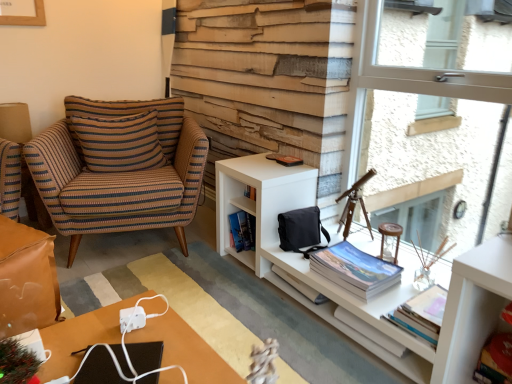
Question: Can you confirm if white paper book at center, which appears as the 2th book when viewed from the right, is taller than matte paper book at lower right, the 3th book in the right-to-left sequence?

Choices:
 (A) yes
 (B) no

Answer: (B)

Question: Does white paper book at center, which appears as the 2th book when viewed from the right, turn towards matte paper book at lower right, the second book when ordered from left to right?

Choices:
 (A) yes
 (B) no

Answer: (B)

Question: From the image's perspective, is white paper book at center, which appears as the 2th book when viewed from the right, beneath matte paper book at lower right, the 3th book in the right-to-left sequence?

Choices:
 (A) yes
 (B) no

Answer: (A)

Question: From the image's perspective, is white paper book at center, the 3th book positioned from the left, above matte paper book at lower right, the second book when ordered from left to right?

Choices:
 (A) no
 (B) yes

Answer: (A)

Question: From a real-world perspective, is white paper book at center, which appears as the 2th book when viewed from the right, located higher than matte paper book at lower right, the second book when ordered from left to right?

Choices:
 (A) no
 (B) yes

Answer: (A)

Question: Considering the positions of striped fabric pillow at upper left and brown leather table at lower left in the image, is striped fabric pillow at upper left bigger or smaller than brown leather table at lower left?

Choices:
 (A) big
 (B) small

Answer: (B)

Question: From their relative heights in the image, would you say striped fabric pillow at upper left is taller or shorter than brown leather table at lower left?

Choices:
 (A) tall
 (B) short

Answer: (B)

Question: From a real-world perspective, is striped fabric pillow at upper left physically located above or below brown leather table at lower left?

Choices:
 (A) below
 (B) above

Answer: (B)

Question: Considering the positions of point (83, 127) and point (30, 306), is point (83, 127) closer or farther from the camera than point (30, 306)?

Choices:
 (A) farther
 (B) closer

Answer: (A)

Question: Is point (362, 125) positioned closer to the camera than point (19, 238)?

Choices:
 (A) farther
 (B) closer

Answer: (A)

Question: Based on their positions, is transparent glass window at upper right located to the left or right of brown leather table at lower left?

Choices:
 (A) left
 (B) right

Answer: (B)

Question: Is transparent glass window at upper right inside or outside of brown leather table at lower left?

Choices:
 (A) inside
 (B) outside

Answer: (B)

Question: Is transparent glass window at upper right wider or thinner than brown leather table at lower left?

Choices:
 (A) thin
 (B) wide

Answer: (A)

Question: Considering the positions of white paper book at center, which appears as the 2th book when viewed from the right, and white matte cabinet at right in the image, is white paper book at center, which appears as the 2th book when viewed from the right, wider or thinner than white matte cabinet at right?

Choices:
 (A) wide
 (B) thin

Answer: (B)

Question: Considering the positions of white paper book at center, which appears as the 2th book when viewed from the right, and white matte cabinet at right in the image, is white paper book at center, which appears as the 2th book when viewed from the right, taller or shorter than white matte cabinet at right?

Choices:
 (A) tall
 (B) short

Answer: (B)